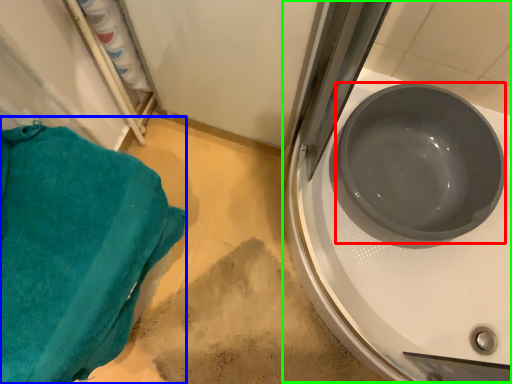
Question: Which object is positioned farthest from basin (highlighted by a red box)? Select from towel/napkin (highlighted by a blue box) and sink (highlighted by a green box).

Choices:
 (A) towel/napkin
 (B) sink

Answer: (A)